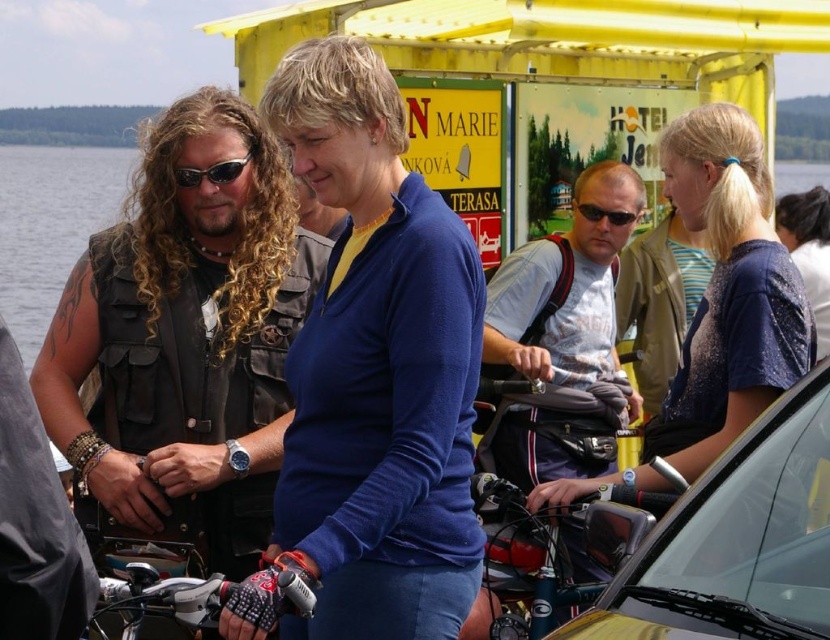
You are standing at the camera position and want to know how far the point at coordinates (155, 532) is from you. Can you determine the distance?

The point at coordinates (155, 532) is 10.19 meters away from the camera position.

You are a painter standing at the lakeside and want to paint the scene. You notice the leather vest at center and the transparent water at center. Which object would require you to use more layers of paint to accurately depict its texture?

The leather vest at center is thinner than transparent water at center, so you would need more layers of paint to depict the texture of the leather vest at center since thinner materials often require more detailed layers to capture their texture accurately.